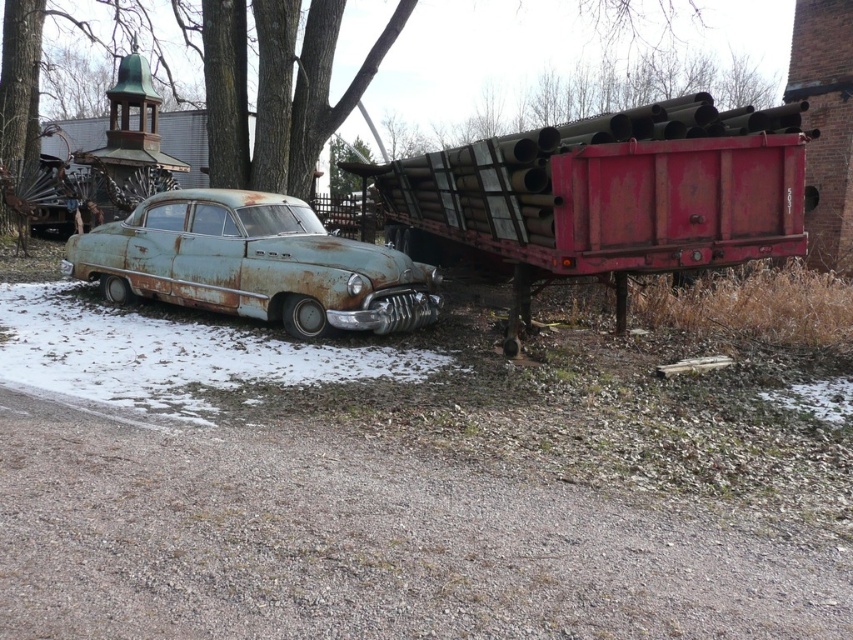
You are a delivery driver who needs to navigate a narrow gravel driveway. You see a rusty metal trailer truck at right and a rusty metal car at center. Which vehicle should you avoid to ensure you can pass through the driveway safely?

The rusty metal trailer truck at right is wider than the rusty metal car at center, so you should avoid the rusty metal trailer truck at right to ensure you can pass through the driveway safely.

From the picture: You are a delivery driver who needs to park your truck in this area. The rusty metal trailer truck at right and the rusty metal car at center are already parked. Which vehicle should you avoid driving near because it is taller?

The rusty metal trailer truck at right is taller than the rusty metal car at center, so you should avoid driving near the rusty metal trailer truck at right because it is taller.